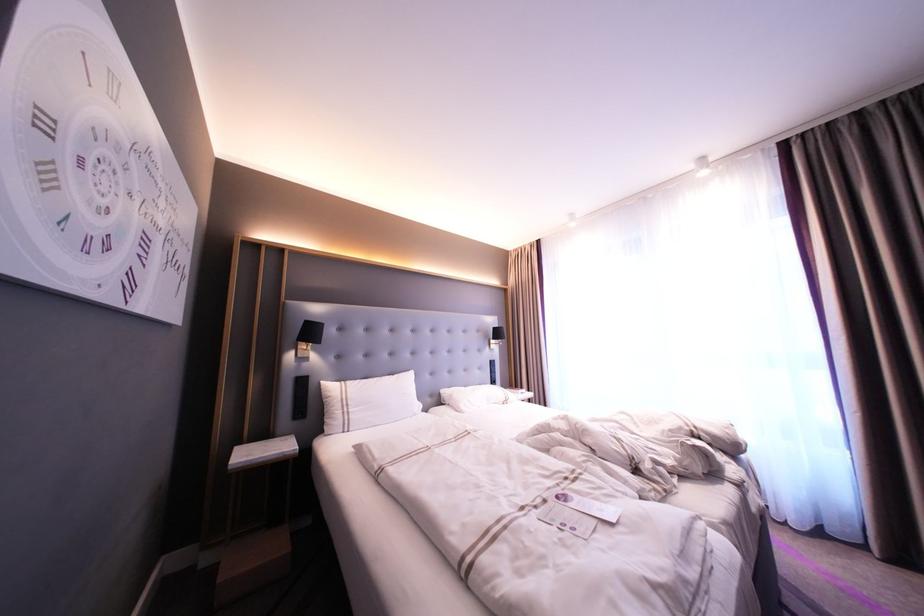
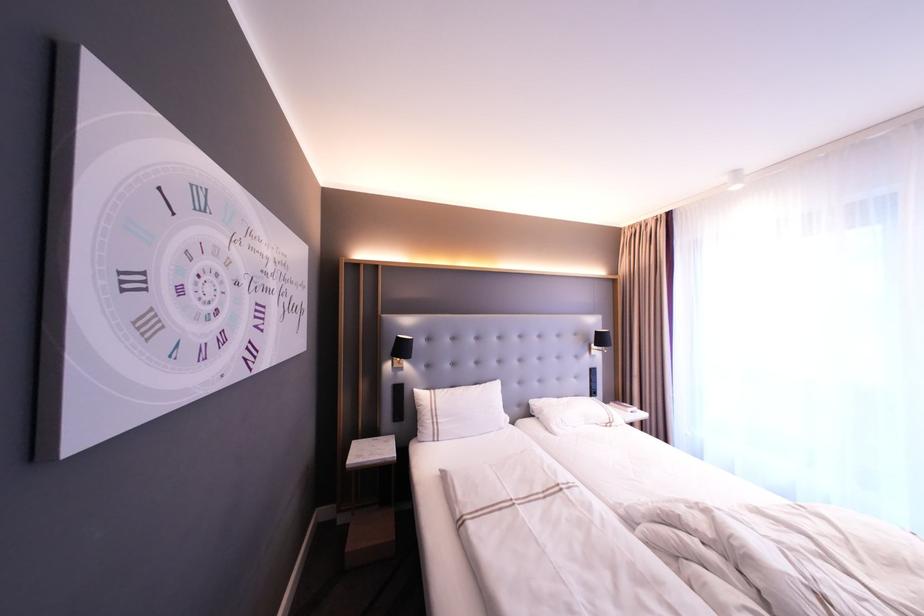
The point at (492, 341) is marked in the first image. Where is the corresponding point in the second image?

(592, 346)